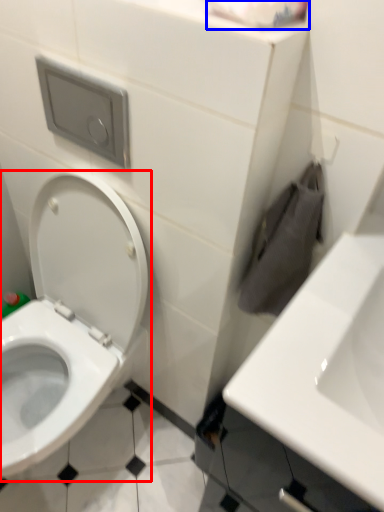
Question: Which object is closer to the camera taking this photo, toilet (highlighted by a red box) or toilet paper (highlighted by a blue box)?

Choices:
 (A) toilet
 (B) toilet paper

Answer: (B)